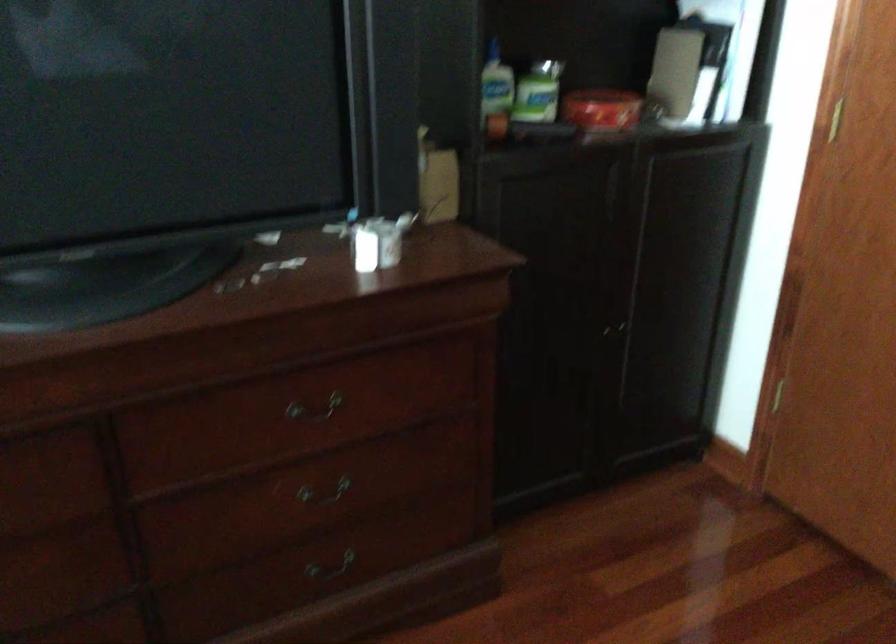
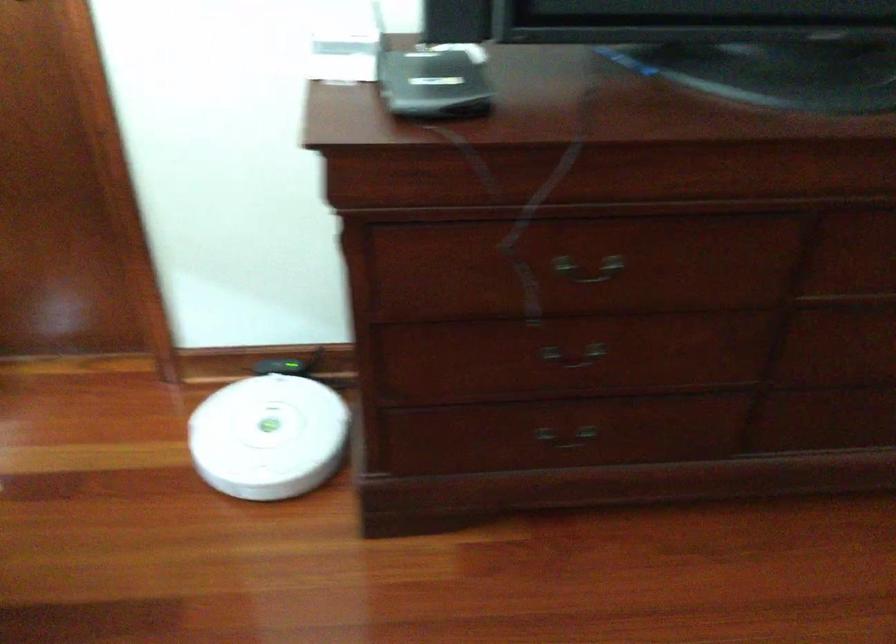
Question: The images are taken continuously from a first-person perspective. In which direction are you moving?

Choices:
 (A) Left
 (B) Right
 (C) Forward
 (D) Backward

Answer: (A)